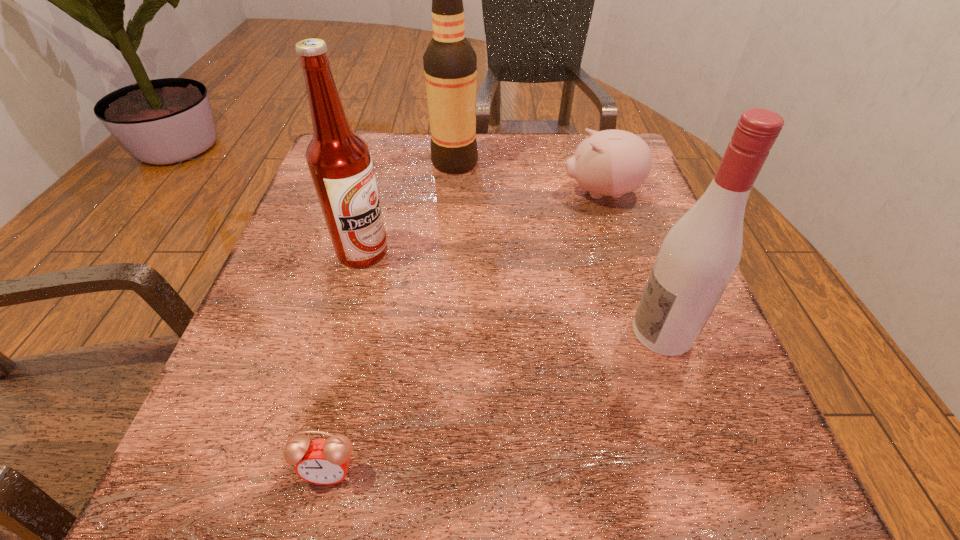
This screenshot has width=960, height=540. In the image, there is a desktop. In order to click on vacant space at the right edge in this screenshot , I will do `click(641, 197)`.

Where is `vacant space at the near left corner of the desktop`? vacant space at the near left corner of the desktop is located at coordinates (221, 448).

You are a GUI agent. You are given a task and a screenshot of the screen. Output one action in this format:
    pyautogui.click(x=<x>, y=<y>)
    Task: Click on the free space between the piggy bank and the alarm clock
    
    Given the screenshot: What is the action you would take?
    pyautogui.click(x=466, y=332)

This screenshot has width=960, height=540. In order to click on vacant region between the second nearest alcohol and the second alcohol from left to right in this screenshot , I will do `click(409, 207)`.

You are a GUI agent. You are given a task and a screenshot of the screen. Output one action in this format:
    pyautogui.click(x=<x>, y=<y>)
    Task: Click on the empty location between the piggy bank and the third object from right to left
    
    Given the screenshot: What is the action you would take?
    pyautogui.click(x=528, y=178)

The height and width of the screenshot is (540, 960). Identify the location of vacant region between the shortest object and the fourth tallest object. (466, 332).

Where is `free space that is in between the third farthest object and the second nearest object`? This screenshot has width=960, height=540. free space that is in between the third farthest object and the second nearest object is located at coordinates (513, 292).

Locate an element on the screen. The width and height of the screenshot is (960, 540). free space that is in between the fourth farthest object and the third farthest object is located at coordinates (513, 292).

The image size is (960, 540). In order to click on free space that is in between the fourth farthest object and the third object from right to left in this screenshot , I will do `click(559, 247)`.

Locate an element on the screen. Image resolution: width=960 pixels, height=540 pixels. vacant space that's between the farthest alcohol and the second nearest object is located at coordinates (559, 247).